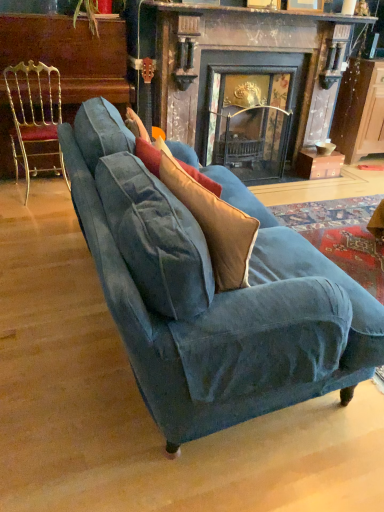
Question: Considering the positions of velvet blue couch at center and dark wood fireplace at center in the image, is velvet blue couch at center taller or shorter than dark wood fireplace at center?

Choices:
 (A) short
 (B) tall

Answer: (A)

Question: Is velvet blue couch at center to the left or to the right of dark wood fireplace at center in the image?

Choices:
 (A) left
 (B) right

Answer: (A)

Question: Estimate the real-world distances between objects in this image. Which object is closer to the gold metallic chair at left?

Choices:
 (A) dark wood fireplace at center
 (B) velvet blue couch at center
 (C) velvet beige throw pillow at center
 (D) wooden cabinet at right

Answer: (A)

Question: Estimate the real-world distances between objects in this image. Which object is closer to the velvet blue couch at center?

Choices:
 (A) velvet beige throw pillow at center
 (B) wooden cabinet at right
 (C) dark wood fireplace at center
 (D) gold metallic chair at left

Answer: (A)